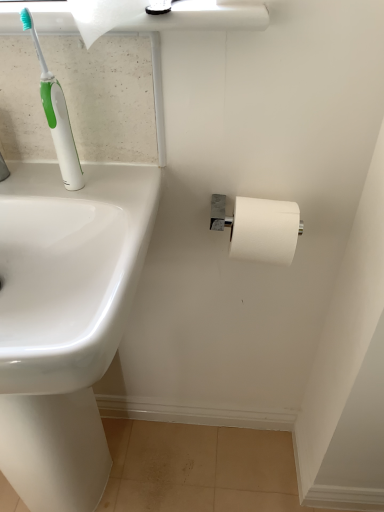
Question: From a real-world perspective, is white matte toilet paper at upper left, marked as the first toilet paper in a front-to-back arrangement, positioned under white glossy sink at left based on gravity?

Choices:
 (A) no
 (B) yes

Answer: (A)

Question: Does white matte toilet paper at upper left, the 2th toilet paper from the back, come in front of white glossy sink at left?

Choices:
 (A) no
 (B) yes

Answer: (A)

Question: Could you tell me if white matte toilet paper at upper left, arranged as the 2th toilet paper when viewed from the right, is facing white glossy sink at left?

Choices:
 (A) yes
 (B) no

Answer: (B)

Question: Is white matte toilet paper at upper left, which ranks as the first toilet paper in top-to-bottom order, at the left side of white glossy sink at left?

Choices:
 (A) yes
 (B) no

Answer: (B)

Question: Considering the relative sizes of white matte toilet paper at upper left, the 2th toilet paper ordered from the bottom, and white glossy sink at left in the image provided, is white matte toilet paper at upper left, the 2th toilet paper ordered from the bottom, wider than white glossy sink at left?

Choices:
 (A) yes
 (B) no

Answer: (B)

Question: From the image's perspective, is white matte toilet paper at upper left, which ranks as the first toilet paper in top-to-bottom order, positioned above or below white matte toilet paper at right, positioned as the first toilet paper in bottom-to-top order?

Choices:
 (A) above
 (B) below

Answer: (A)

Question: Considering the positions of white matte toilet paper at upper left, which ranks as the first toilet paper in top-to-bottom order, and white matte toilet paper at right, the 2th toilet paper when ordered from left to right, in the image, is white matte toilet paper at upper left, which ranks as the first toilet paper in top-to-bottom order, wider or thinner than white matte toilet paper at right, the 2th toilet paper when ordered from left to right,?

Choices:
 (A) wide
 (B) thin

Answer: (B)

Question: Is white matte toilet paper at upper left, the 2th toilet paper from the back, inside the boundaries of white matte toilet paper at right, which is the 1th toilet paper in right-to-left order, or outside?

Choices:
 (A) inside
 (B) outside

Answer: (B)

Question: Considering the positions of white matte toilet paper at upper left, arranged as the 2th toilet paper when viewed from the right, and white matte toilet paper at right, positioned as the second toilet paper in top-to-bottom order, in the image, is white matte toilet paper at upper left, arranged as the 2th toilet paper when viewed from the right, taller or shorter than white matte toilet paper at right, positioned as the second toilet paper in top-to-bottom order,?

Choices:
 (A) short
 (B) tall

Answer: (B)

Question: From the image's perspective, is green plastic toothbrush at upper left above or below white matte toilet paper at upper left, which is the first toilet paper in left-to-right order?

Choices:
 (A) above
 (B) below

Answer: (B)

Question: Based on their positions, is green plastic toothbrush at upper left located to the left or right of white matte toilet paper at upper left, the 2th toilet paper ordered from the bottom?

Choices:
 (A) right
 (B) left

Answer: (B)

Question: Considering the positions of green plastic toothbrush at upper left and white matte toilet paper at upper left, marked as the first toilet paper in a front-to-back arrangement, in the image, is green plastic toothbrush at upper left bigger or smaller than white matte toilet paper at upper left, marked as the first toilet paper in a front-to-back arrangement,?

Choices:
 (A) big
 (B) small

Answer: (B)

Question: Is green plastic toothbrush at upper left inside or outside of white matte toilet paper at upper left, arranged as the 2th toilet paper when viewed from the right?

Choices:
 (A) inside
 (B) outside

Answer: (B)

Question: Is white matte toilet paper at right, which ranks as the 1th toilet paper in back-to-front order, bigger or smaller than white glossy sink at left?

Choices:
 (A) big
 (B) small

Answer: (B)

Question: Looking at their shapes, would you say white matte toilet paper at right, which is the 1th toilet paper in right-to-left order, is wider or thinner than white glossy sink at left?

Choices:
 (A) thin
 (B) wide

Answer: (A)